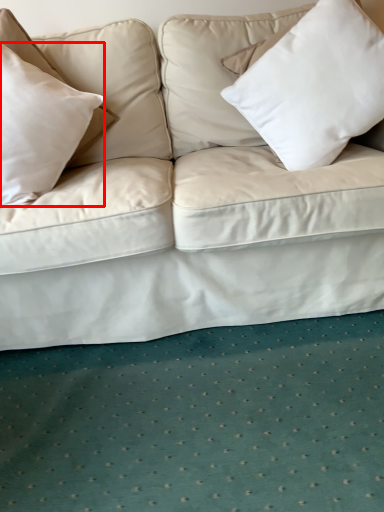
Question: From the image, what is the correct spatial relationship of pillow (annotated by the red box) in relation to pillow?

Choices:
 (A) right
 (B) left

Answer: (B)